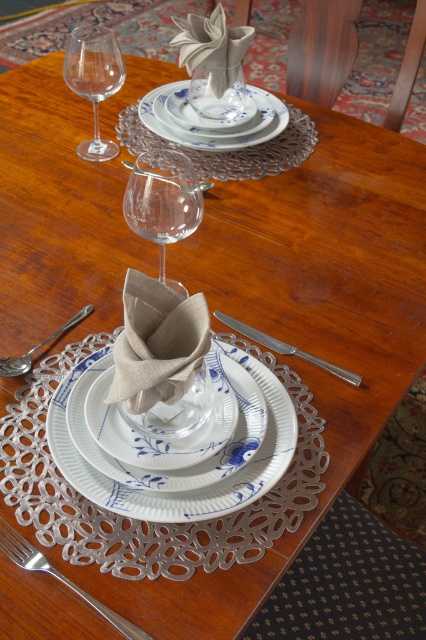
You are a guest at this dinner and need to place your napkin. The napkin is currently on the blue and white porcelain saucer at center. Can you move it to the shiny silver spoon at upper center without it falling off?

The blue and white porcelain saucer at center is much taller than the shiny silver spoon at upper center, so moving the napkin from the saucer to the spoon might cause it to fall since the spoon is shorter and less stable.

You are a photographer adjusting your camera settings to capture the dining table scene. You notice two points of interest labeled as point (86,464) and point (201,188). Which point should you focus on first to ensure both are in sharp focus?

Point (86,464) is closer to the camera than point (201,188). To ensure both are in sharp focus, you should focus on the closer point first, which is point (86,464).

You are setting up a small decorative item that is 10 cm in width. You want to place it on the table without overlapping any existing items. Considering the white porcelain plate at center and the shiny silver spoon at upper center, which item has a larger surface area to accommodate the decorative item?

The white porcelain plate at center is wider than the shiny silver spoon at upper center, so it has a larger surface area and can accommodate the decorative item.